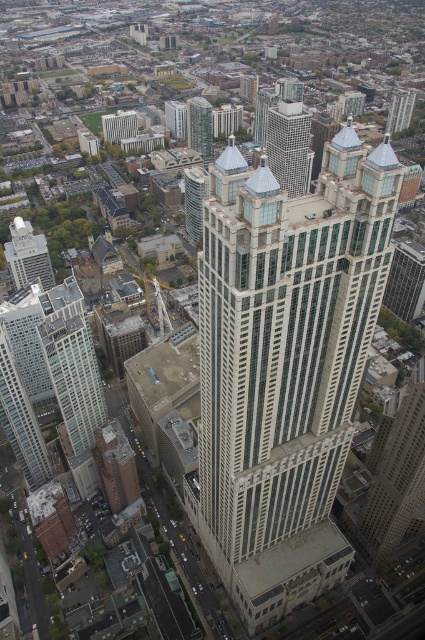
Question: In this image, where is glassy steel skyscraper at center located relative to glassy reflective skyscraper at upper center?

Choices:
 (A) left
 (B) right

Answer: (B)

Question: Which of the following is the farthest from the observer?

Choices:
 (A) [206, 128]
 (B) [217, 452]

Answer: (A)

Question: Which point is closer to the camera?

Choices:
 (A) pyautogui.click(x=31, y=264)
 (B) pyautogui.click(x=282, y=164)

Answer: (A)

Question: Where is glassy white skyscraper at center located in relation to glassy reflective skyscraper at upper center in the image?

Choices:
 (A) below
 (B) above

Answer: (A)

Question: Does matte glass skyscraper at lower left have a greater width compared to glassy reflective skyscraper at upper center?

Choices:
 (A) no
 (B) yes

Answer: (B)

Question: Which point is closer to the camera taking this photo?

Choices:
 (A) (198, 120)
 (B) (25, 241)
 (C) (303, 291)
 (D) (297, 172)

Answer: (C)